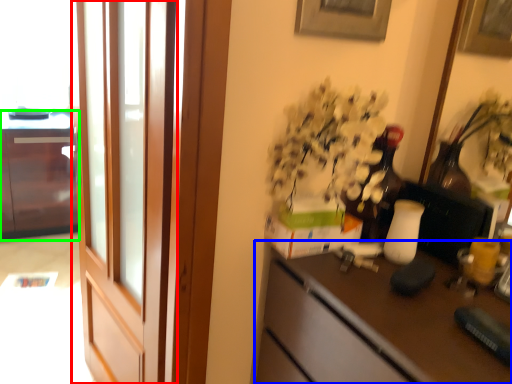
Question: Considering the real-world distances, which object is farthest from screen door (highlighted by a red box)? desk (highlighted by a blue box) or cabinetry (highlighted by a green box)?

Choices:
 (A) desk
 (B) cabinetry

Answer: (B)